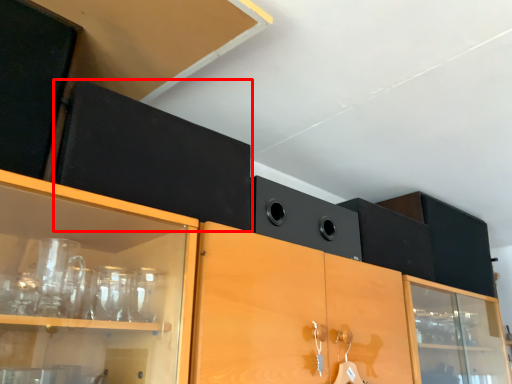
Question: From the image's perspective, what is the correct spatial relationship of cabinetry (annotated by the red box) in relation to speaker?

Choices:
 (A) below
 (B) above

Answer: (B)